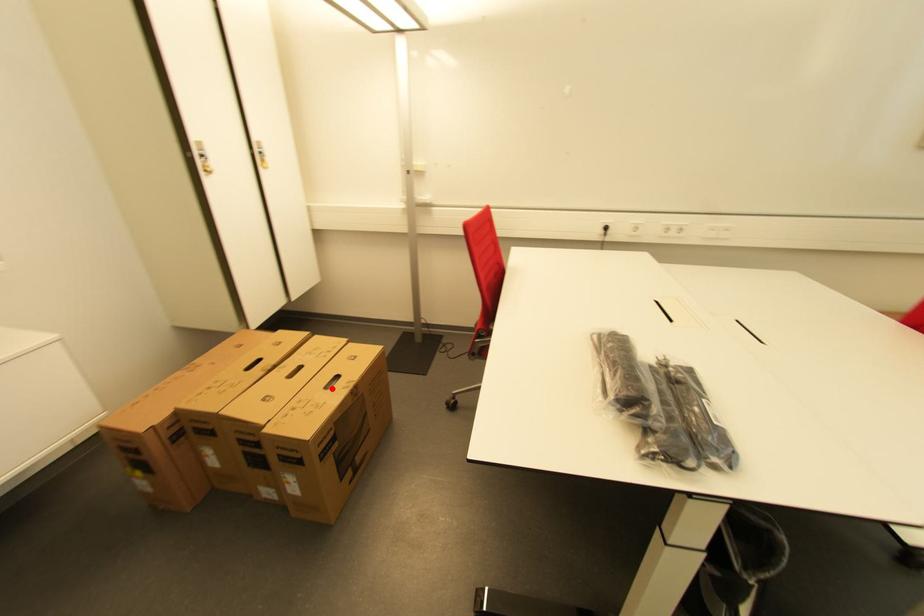
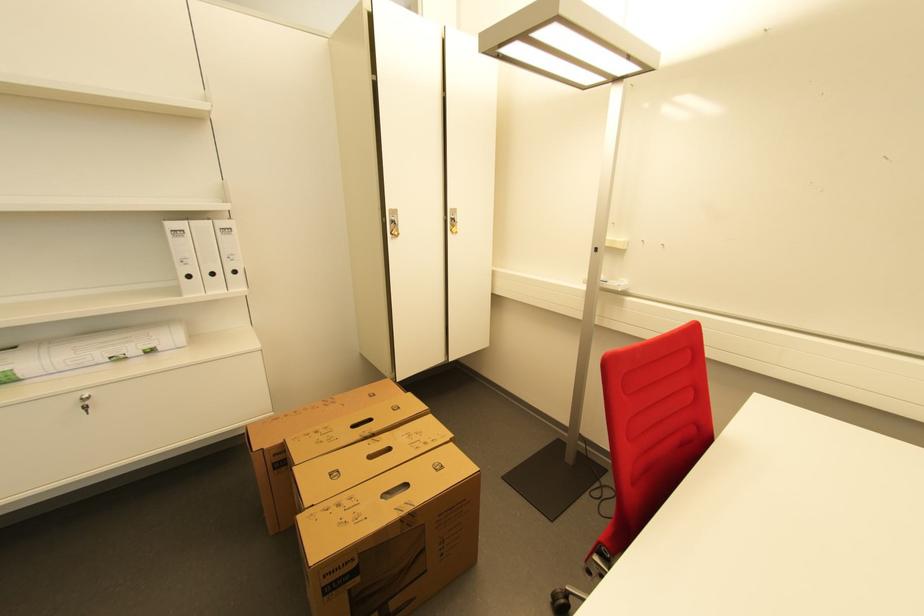
Where in the second image is the point corresponding to the highlighted location from the first image?

(388, 496)